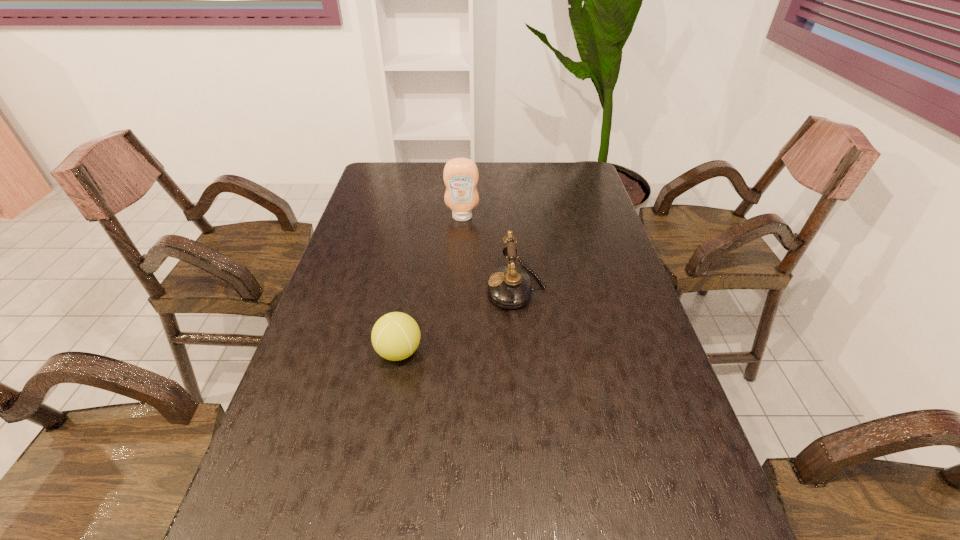
The width and height of the screenshot is (960, 540). I want to click on the second object from right to left, so click(460, 175).

This screenshot has width=960, height=540. Find the location of `the tallest object`. the tallest object is located at coordinates (460, 175).

Locate an element on the screen. the second tallest object is located at coordinates (509, 287).

I want to click on the second nearest object, so click(509, 287).

Locate an element on the screen. the shortest object is located at coordinates (395, 336).

In order to click on the leftmost object in this screenshot , I will do `click(395, 336)`.

At what (x,y) coordinates should I click in order to perform the action: click on vacant space situated 0.210m on the label of the condiment. Please return your answer as a coordinate pair (x, y). The height and width of the screenshot is (540, 960). Looking at the image, I should click on (460, 261).

The height and width of the screenshot is (540, 960). I want to click on blank area located 0.140m on the dial of the rightmost object, so click(439, 287).

Image resolution: width=960 pixels, height=540 pixels. I want to click on free region located on the dial of the rightmost object, so click(x=418, y=287).

Where is `blank space located 0.360m on the dial of the rightmost object`? The height and width of the screenshot is (540, 960). blank space located 0.360m on the dial of the rightmost object is located at coordinates (361, 287).